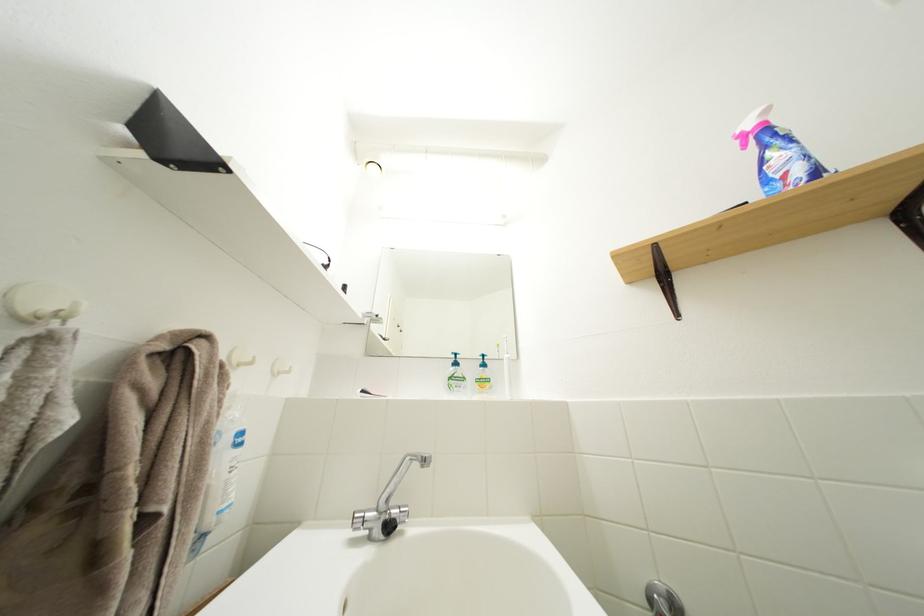
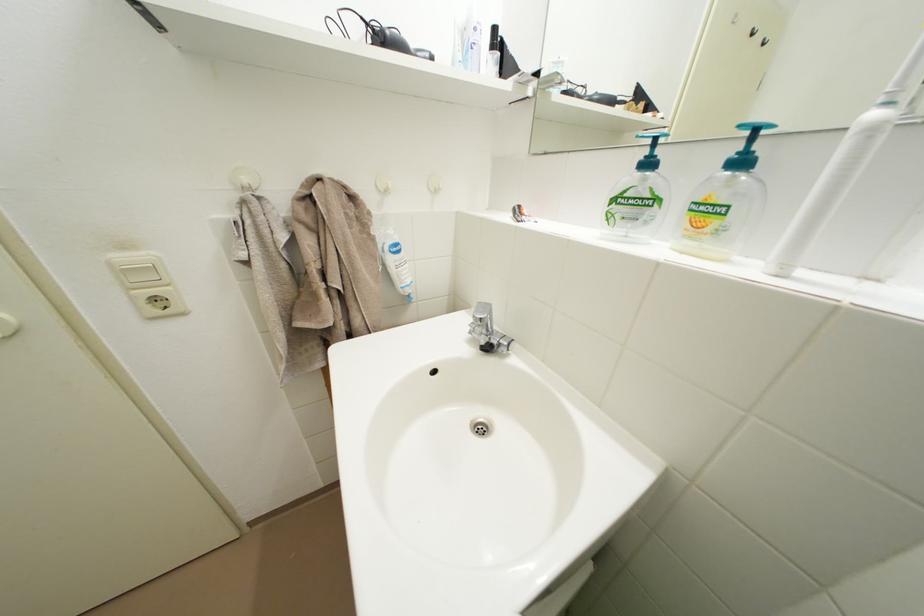
The images are taken continuously from a first-person perspective. In which direction is your viewpoint rotating?

The camera's rotation is toward left-down.